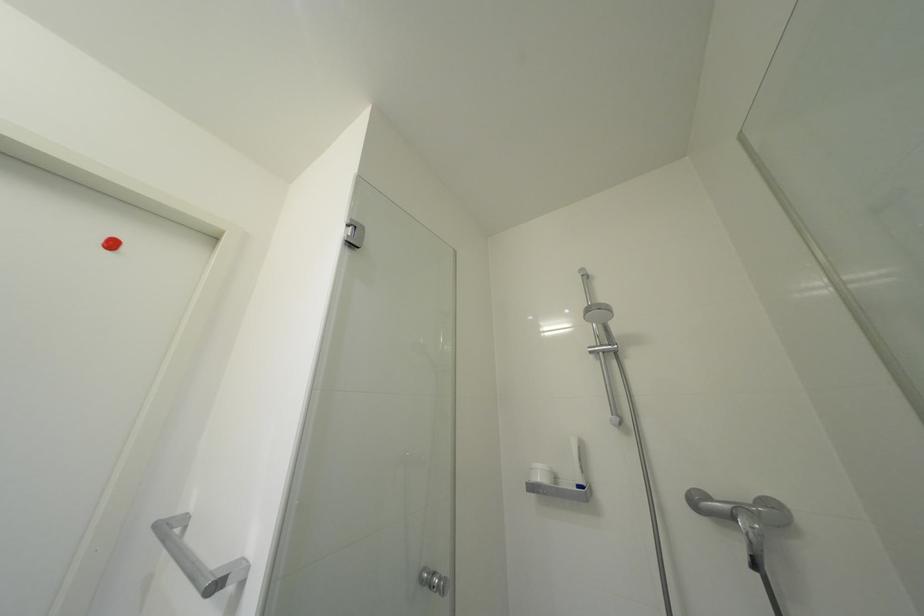
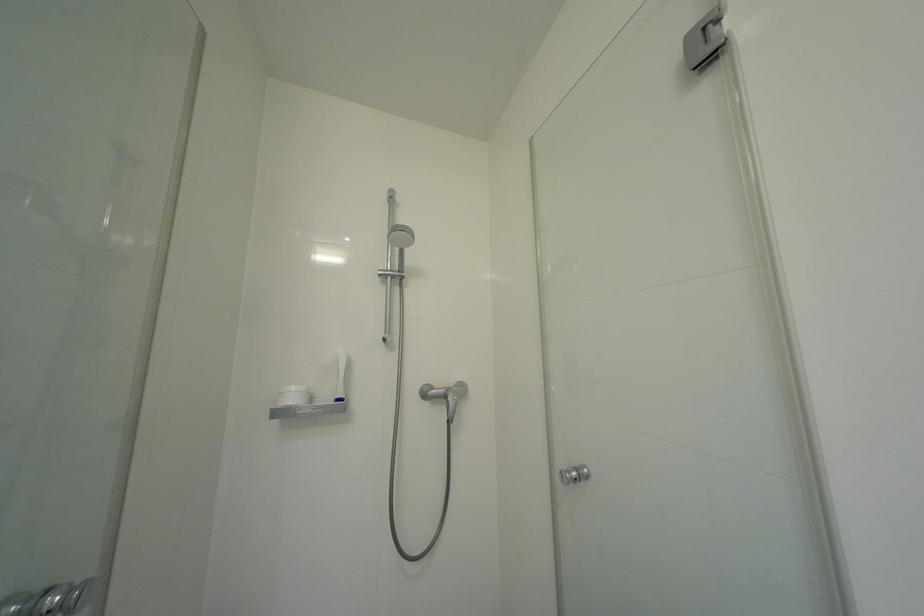
Question: The camera is either moving clockwise (left) or counter-clockwise (right) around the object. The first image is from the beginning of the video and the second image is from the end. Is the camera moving left or right when shooting the video?

Choices:
 (A) Left
 (B) Right

Answer: (A)